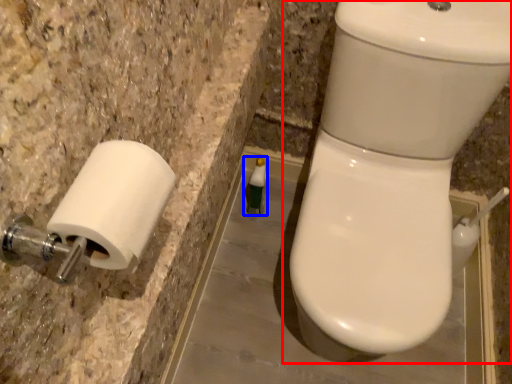
Question: Among these objects, which one is farthest to the camera, toilet (highlighted by a red box) or toiletry (highlighted by a blue box)?

Choices:
 (A) toilet
 (B) toiletry

Answer: (B)